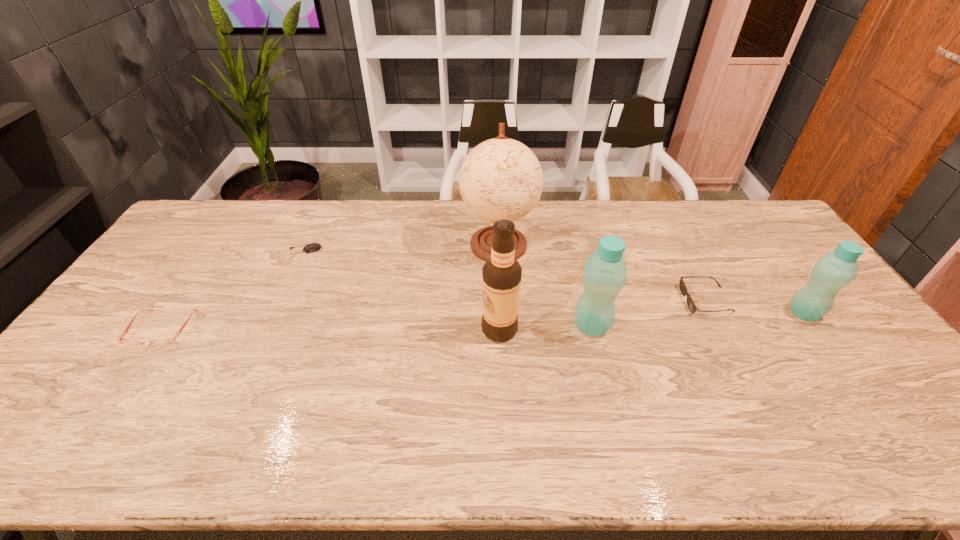
What are the coordinates of `free region that satisfies the following two spatial constraints: 1. on the back side of the fourth tallest object; 2. on the right side of the fifth shortest object` in the screenshot? It's located at (588, 313).

Identify the location of vacant area in the image that satisfies the following two spatial constraints: 1. on the front-facing side of the fourth tallest object; 2. on the right side of the sunglasses. The height and width of the screenshot is (540, 960). (712, 313).

Identify the location of free space that satisfies the following two spatial constraints: 1. on the front-facing side of the sunglasses; 2. on the lenses of the spectacles. (721, 329).

At what (x,y) coordinates should I click in order to perform the action: click on free region that satisfies the following two spatial constraints: 1. on the front-facing side of the sunglasses; 2. on the lenses of the spectacles. Please return your answer as a coordinate pair (x, y). The width and height of the screenshot is (960, 540). Looking at the image, I should click on (721, 329).

Find the location of `free spot that satisfies the following two spatial constraints: 1. on the front side of the sixth object from right to left; 2. on the left side of the fifth object from left to right`. free spot that satisfies the following two spatial constraints: 1. on the front side of the sixth object from right to left; 2. on the left side of the fifth object from left to right is located at coordinates (271, 326).